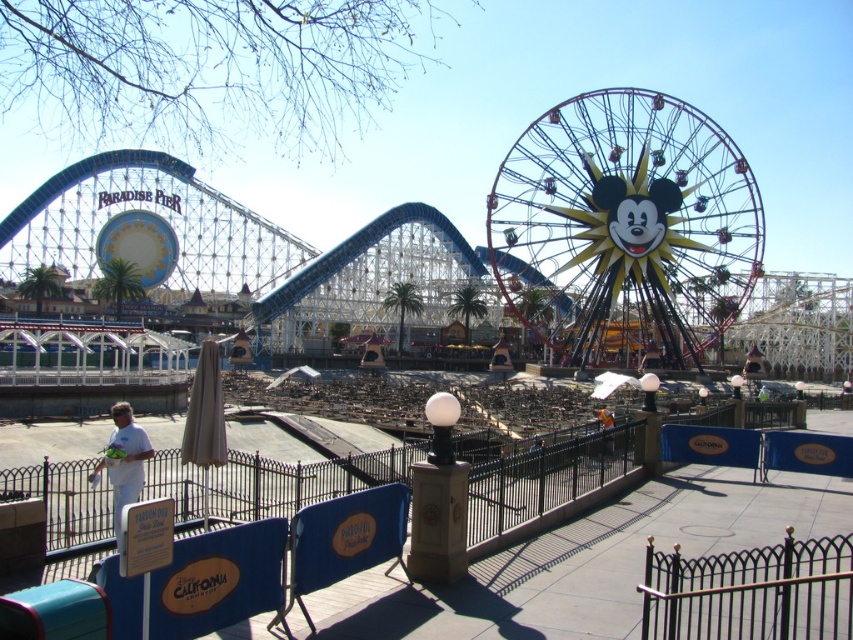
Consider the image. Is metallic yellow ferris wheel at center positioned at the back of white matte shirt at lower left?

Yes, it is behind white matte shirt at lower left.

Measure the distance between point (750, 250) and camera.

464.85 feet

Who is more distant from viewer, (549, 346) or (126, 444)?

Positioned behind is point (549, 346).

This screenshot has height=640, width=853. In order to click on metallic yellow ferris wheel at center in this screenshot , I will do `click(625, 228)`.